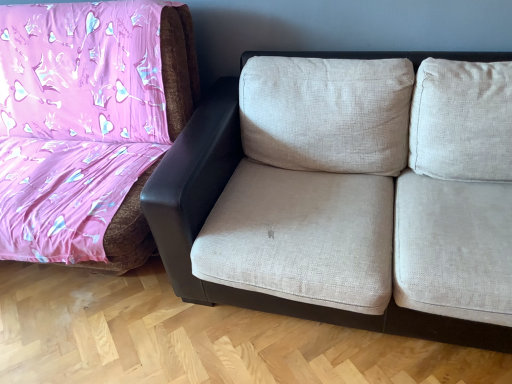
In order to face beige fabric couch at left, should I rotate leftwards or rightwards?

You should rotate left by 29.666 degrees.

Locate an element on the screen. The image size is (512, 384). beige fabric couch at left is located at coordinates (178, 67).

What is the approximate height of beige fabric couch at left?

Answer: 38.84 inches.

What do you see at coordinates (178, 67) in the screenshot? I see `beige fabric couch at left` at bounding box center [178, 67].

I want to click on beige fabric couch at left, so click(x=178, y=67).